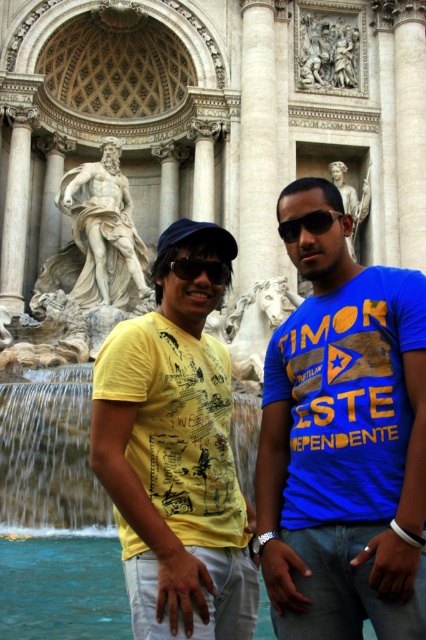
Does white marble column at left have a lesser height compared to black plastic sunglasses at center?

Incorrect, white marble column at left's height does not fall short of black plastic sunglasses at center's.

Image resolution: width=426 pixels, height=640 pixels. Describe the element at coordinates (16, 218) in the screenshot. I see `white marble column at left` at that location.

Locate an element on the screen. This screenshot has height=640, width=426. white marble column at left is located at coordinates (16, 218).

Can you confirm if white marble statue at center is shorter than black plastic sunglasses at center?

In fact, white marble statue at center may be taller than black plastic sunglasses at center.

Does white marble statue at center appear on the right side of black plastic sunglasses at center?

No, white marble statue at center is not to the right of black plastic sunglasses at center.

At what (x,y) coordinates should I click in order to perform the action: click on white marble statue at center. Please return your answer as a coordinate pair (x, y). This screenshot has width=426, height=640. Looking at the image, I should click on (103, 230).

Between point (279, 524) and point (51, 484), which one is positioned behind?

The point (51, 484) is more distant.

Between blue cotton shirt at center and translucent water at center, which one appears on the left side from the viewer's perspective?

translucent water at center is more to the left.

What are the coordinates of `blue cotton shirt at center` in the screenshot? It's located at (344, 449).